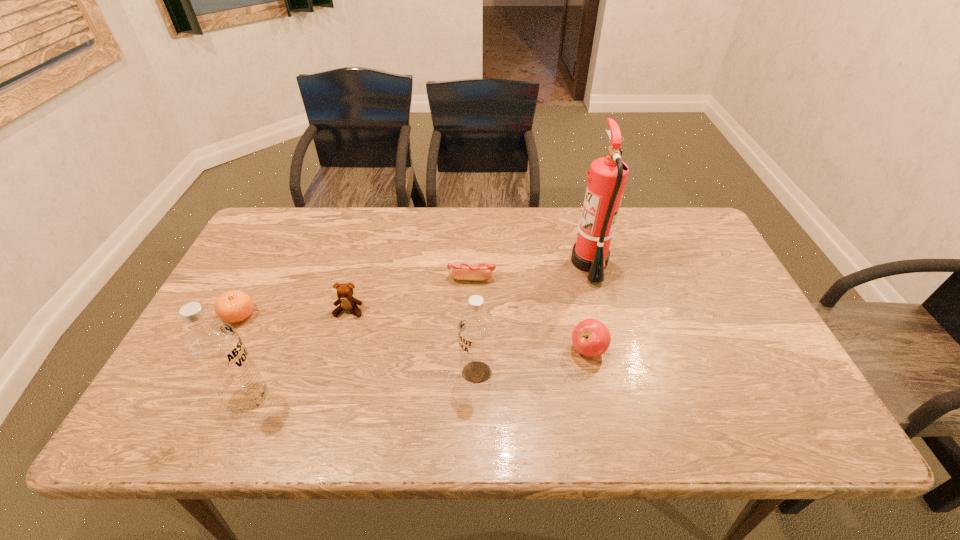
This screenshot has height=540, width=960. What are the coordinates of `free space located on the back of the apple` in the screenshot? It's located at (567, 253).

At what (x,y) coordinates should I click in order to perform the action: click on object that is at the far edge. Please return your answer as a coordinate pair (x, y). Looking at the image, I should click on (607, 177).

I want to click on vodka at the left edge, so click(215, 348).

At what (x,y) coordinates should I click in order to perform the action: click on clementine located at the left edge. Please return your answer as a coordinate pair (x, y). Looking at the image, I should click on (233, 306).

Locate an element on the screen. object located in the near left corner section of the desktop is located at coordinates (215, 348).

The width and height of the screenshot is (960, 540). Identify the location of free region at the far edge. (551, 247).

The width and height of the screenshot is (960, 540). In order to click on vacant space at the near edge of the desktop in this screenshot , I will do `click(465, 393)`.

You are a GUI agent. You are given a task and a screenshot of the screen. Output one action in this format:
    pyautogui.click(x=<x>, y=<y>)
    Task: Click on the free space at the right edge of the desktop
    Image resolution: width=960 pixels, height=540 pixels.
    Given the screenshot: What is the action you would take?
    pyautogui.click(x=707, y=280)

In the image, there is a desktop. Find the location of `free space at the far left corner`. free space at the far left corner is located at coordinates (265, 241).

Locate an element on the screen. blank space at the far right corner of the desktop is located at coordinates click(x=680, y=218).